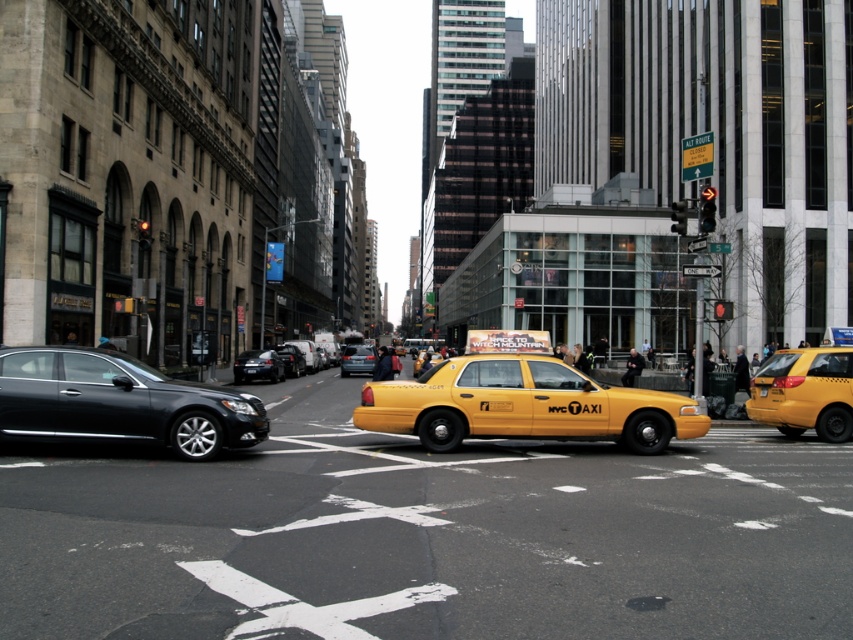
You are a delivery person needing to quickly load a large package into a vehicle. You see a yellow matte taxi at center and a shiny black sedan at center. Which vehicle can accommodate the large package?

The shiny black sedan at center is larger than the yellow matte taxi at center, so it can accommodate the large package.

You are a pedestrian waiting at the crosswalk in the image. You see a yellow matte taxi at center and a shiny black sedan at left. Which vehicle is closer to you?

The yellow matte taxi at center is closer to you because it is further to the viewer than the shiny black sedan at left, meaning it appears nearer in the scene.